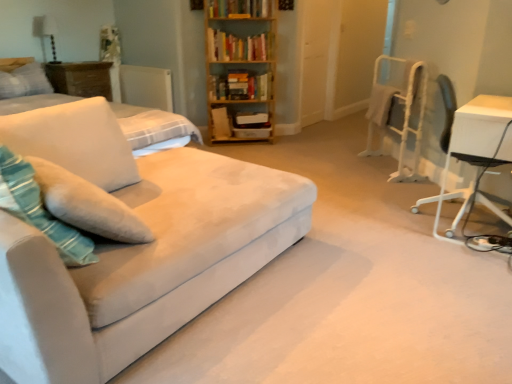
Find the location of a particular element. vacant area that is situated to the right of wooden bookcase at upper center is located at coordinates (290, 146).